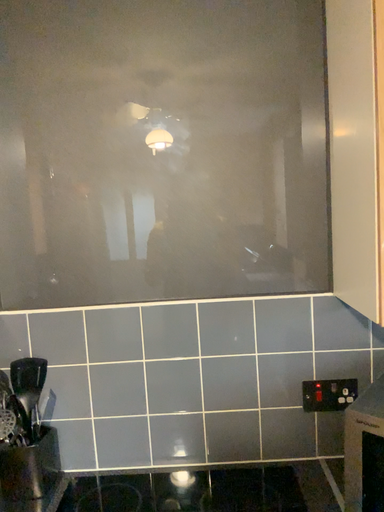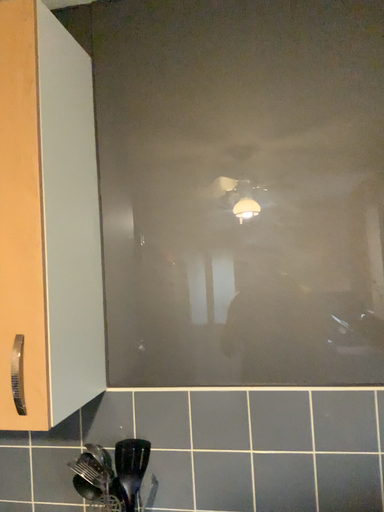
Question: Which way did the camera rotate in the video?

Choices:
 (A) rotated left
 (B) rotated right

Answer: (A)